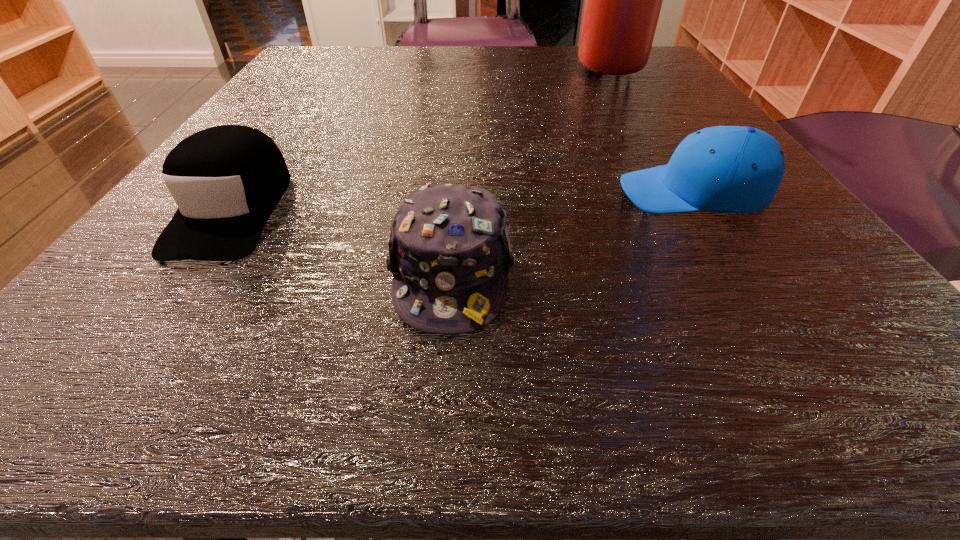
Locate an element on the screen. This screenshot has width=960, height=540. vacant space that satisfies the following two spatial constraints: 1. on the front-facing side of the rightmost headwear; 2. on the front-facing side of the leftmost object is located at coordinates (704, 209).

You are a GUI agent. You are given a task and a screenshot of the screen. Output one action in this format:
    pyautogui.click(x=<x>, y=<y>)
    Task: Click on the free space that satisfies the following two spatial constraints: 1. on the front-facing side of the rightmost headwear; 2. on the front-facing side of the leftmost object
    The image size is (960, 540).
    Given the screenshot: What is the action you would take?
    pyautogui.click(x=704, y=209)